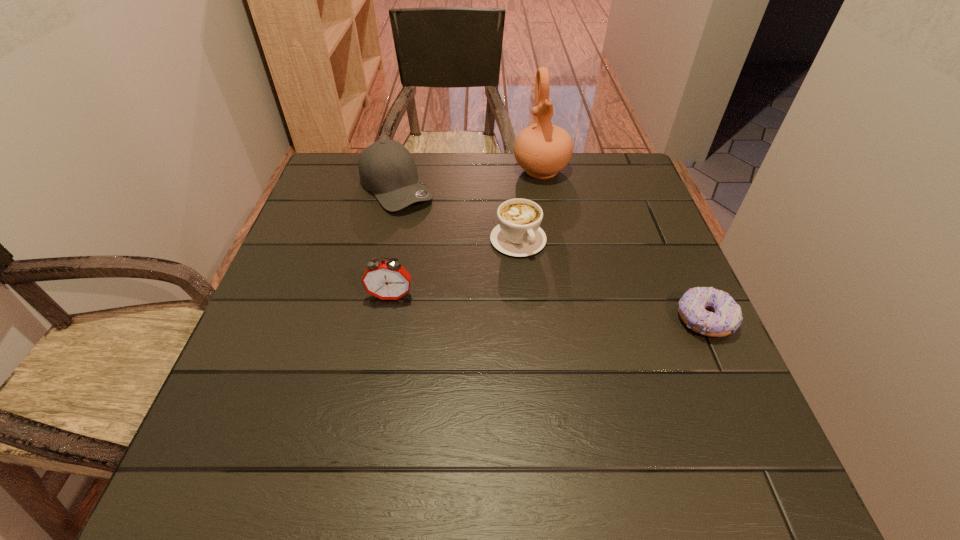
This screenshot has height=540, width=960. I want to click on free space located 0.190m to the right of the second shortest object's handle, so click(x=577, y=316).

You are a GUI agent. You are given a task and a screenshot of the screen. Output one action in this format:
    pyautogui.click(x=<x>, y=<y>)
    Task: Click on the vacant point located to the right of the second shortest object's handle
    This screenshot has width=960, height=540.
    Given the screenshot: What is the action you would take?
    pyautogui.click(x=610, y=357)

You are a GUI agent. You are given a task and a screenshot of the screen. Output one action in this format:
    pyautogui.click(x=<x>, y=<y>)
    Task: Click on the free space located on the spout of the tallest object
    Image resolution: width=960 pixels, height=540 pixels.
    Given the screenshot: What is the action you would take?
    pyautogui.click(x=567, y=258)

You are a GUI agent. You are given a task and a screenshot of the screen. Output one action in this format:
    pyautogui.click(x=<x>, y=<y>)
    Task: Click on the free space located 0.370m on the spout of the tallest object
    This screenshot has width=960, height=540.
    Given the screenshot: What is the action you would take?
    pyautogui.click(x=575, y=283)

Locate an element on the screen. Image resolution: width=960 pixels, height=540 pixels. free space located on the spout of the tallest object is located at coordinates (575, 283).

Identify the location of vacant region located on the front brim of the baseball cap. The width and height of the screenshot is (960, 540). (449, 251).

This screenshot has width=960, height=540. Identify the location of vacant space positioned 0.200m on the front brim of the baseball cap. (454, 255).

The height and width of the screenshot is (540, 960). What are the coordinates of `vacant position located on the front brim of the baseball cap` in the screenshot? It's located at (444, 244).

At what (x,y) coordinates should I click in order to perform the action: click on pottery at the far edge. Please return your answer as a coordinate pair (x, y). The width and height of the screenshot is (960, 540). Looking at the image, I should click on (542, 150).

The width and height of the screenshot is (960, 540). In order to click on baseball cap that is at the far edge in this screenshot , I will do `click(387, 169)`.